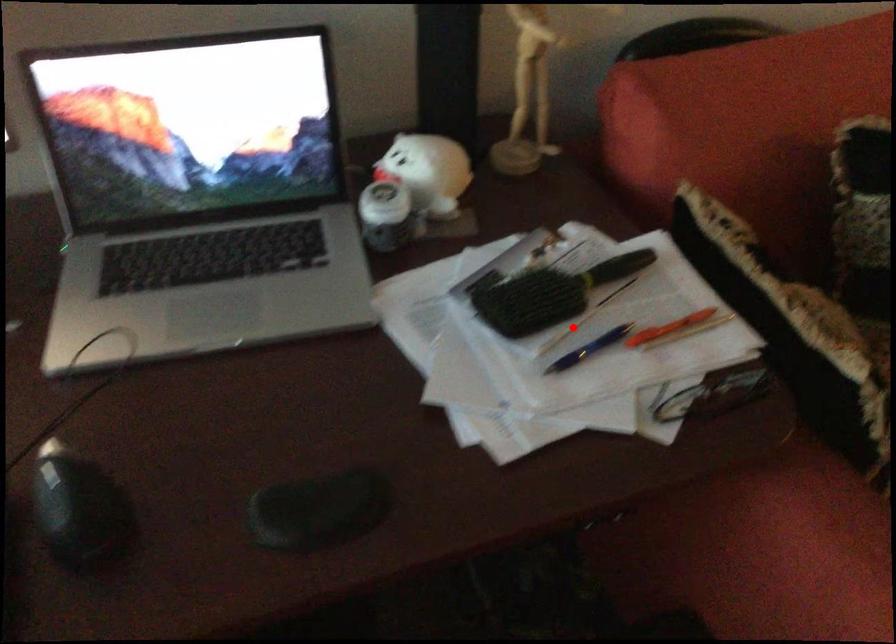
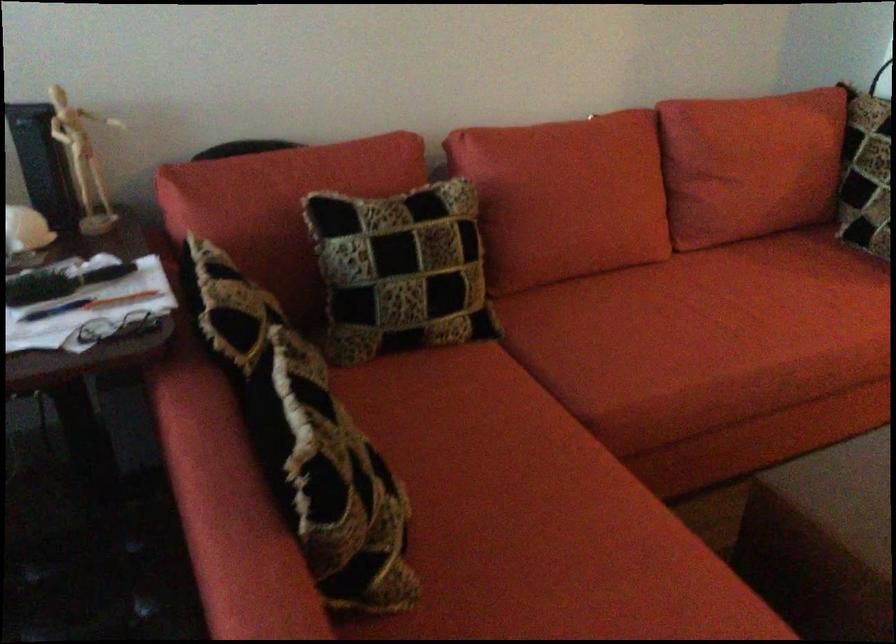
Locate, in the second image, the point that corresponds to the highlighted location in the first image.

(55, 310)